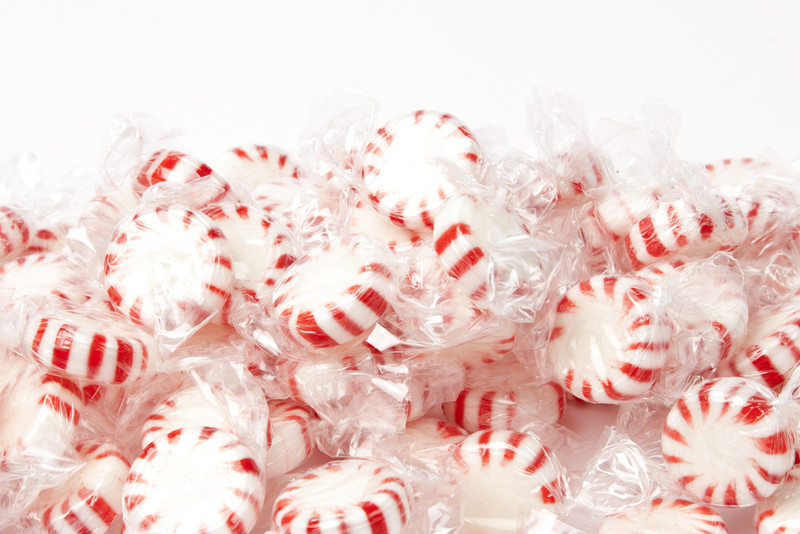
Where is `desk top`? The height and width of the screenshot is (534, 800). desk top is located at coordinates (597, 417).